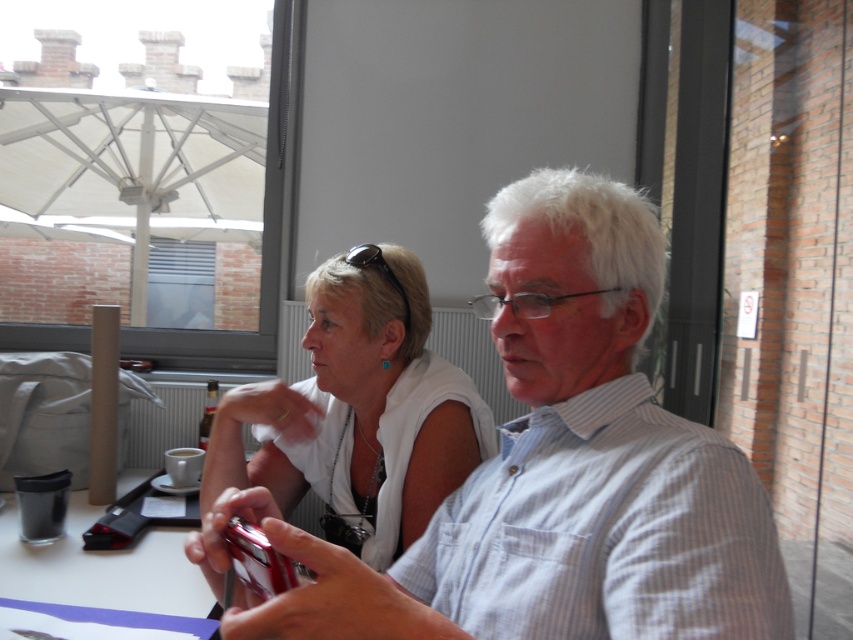
Does white fabric shirt at center have a larger size compared to clear plastic cup at lower left?

Correct, white fabric shirt at center is larger in size than clear plastic cup at lower left.

Does white fabric shirt at center come in front of clear plastic cup at lower left?

No, it is not.

The image size is (853, 640). What do you see at coordinates (358, 412) in the screenshot?
I see `white fabric shirt at center` at bounding box center [358, 412].

You are a GUI agent. You are given a task and a screenshot of the screen. Output one action in this format:
    pyautogui.click(x=<x>, y=<y>)
    Task: Click on the white fabric shirt at center
    Image resolution: width=853 pixels, height=640 pixels.
    Given the screenshot: What is the action you would take?
    pyautogui.click(x=358, y=412)

Is white fabric shirt at center further to camera compared to black plastic sunglasses at upper center?

No, it is not.

Between point (396, 385) and point (347, 260), which one is positioned behind?

Positioned behind is point (396, 385).

Does point (416, 426) come behind point (393, 288)?

No.

Where is `white fabric shirt at center`? This screenshot has width=853, height=640. white fabric shirt at center is located at coordinates (358, 412).

Can you confirm if white striped shirt at center is smaller than clear plastic cup at lower left?

Incorrect, white striped shirt at center is not smaller in size than clear plastic cup at lower left.

Does point (491, 246) come closer to viewer compared to point (177, 536)?

That is True.

Is point (660, 580) positioned behind point (84, 589)?

No, (660, 580) is closer to viewer.

This screenshot has width=853, height=640. What are the coordinates of `white striped shirt at center` in the screenshot? It's located at (566, 467).